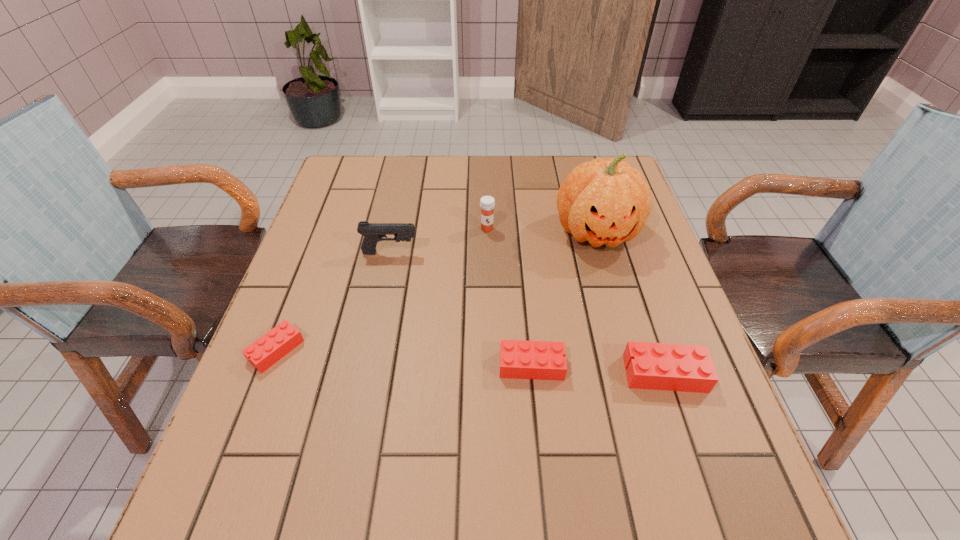
Image resolution: width=960 pixels, height=540 pixels. In order to click on free space located on the left of the second tallest Lego in this screenshot , I will do pos(377,366).

The width and height of the screenshot is (960, 540). In order to click on free spot located on the back of the rightmost Lego in this screenshot , I will do `click(617, 231)`.

Where is `vacant area situated on the label side of the medicine`? This screenshot has height=540, width=960. vacant area situated on the label side of the medicine is located at coordinates (488, 265).

What are the coordinates of `free spot located 0.290m at the barrel of the fifth object from right to left` in the screenshot? It's located at (535, 253).

Locate an element on the screen. The image size is (960, 540). vacant area situated on the carved face of the tallest object is located at coordinates (627, 342).

Locate an element on the screen. Lego that is positioned at the left edge is located at coordinates (263, 353).

The width and height of the screenshot is (960, 540). What are the coordinates of `pistol located at the left edge` in the screenshot? It's located at (373, 232).

Find the location of a particular element. The image size is (960, 540). Lego that is positioned at the right edge is located at coordinates (655, 366).

I want to click on pumpkin located in the right edge section of the desktop, so click(608, 202).

Locate an element on the screen. The image size is (960, 540). vacant region at the far edge of the desktop is located at coordinates (481, 168).